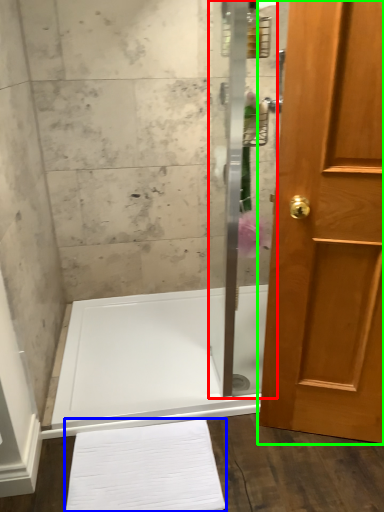
Question: Based on their relative distances, which object is nearer to shower door (highlighted by a red box)? Choose from bath towel (highlighted by a blue box) and door (highlighted by a green box).

Choices:
 (A) bath towel
 (B) door

Answer: (A)